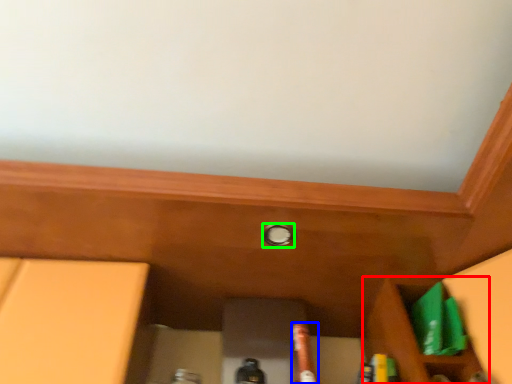
Question: Considering the real-world distances, which object is farthest from cabinetry (highlighted by a red box)? beer bottle (highlighted by a blue box) or knob (highlighted by a green box)?

Choices:
 (A) beer bottle
 (B) knob

Answer: (B)